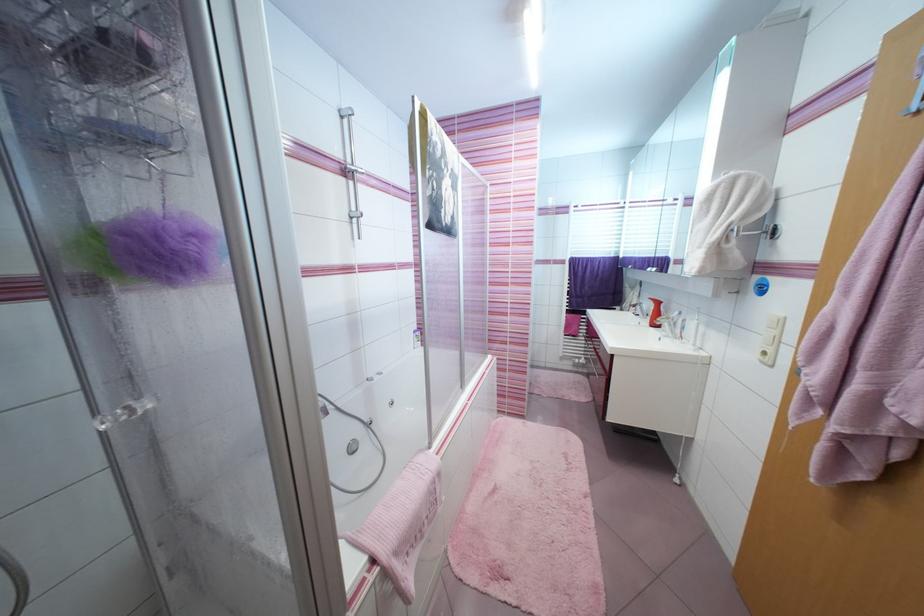
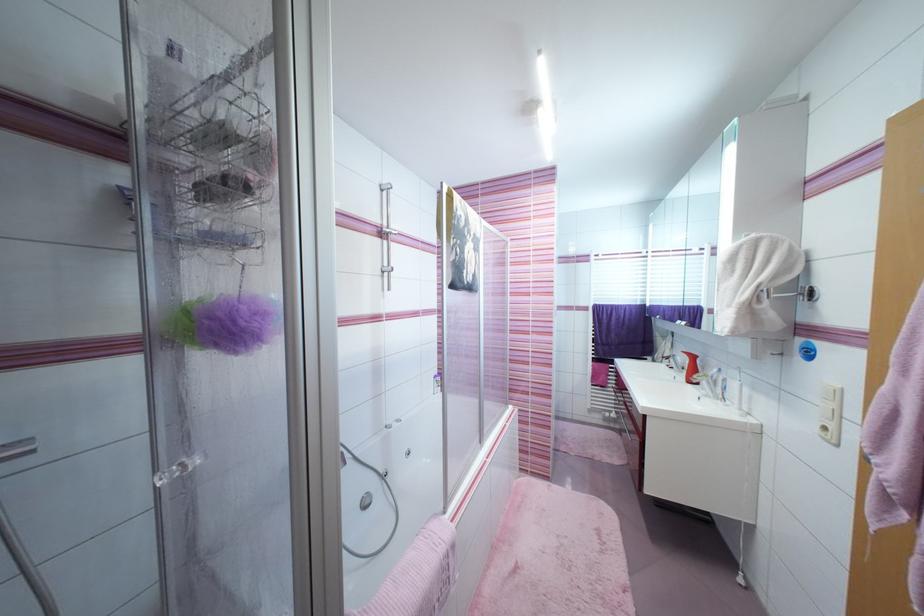
Find the pixel in the second image that matches point (348, 180) in the first image.

(383, 241)